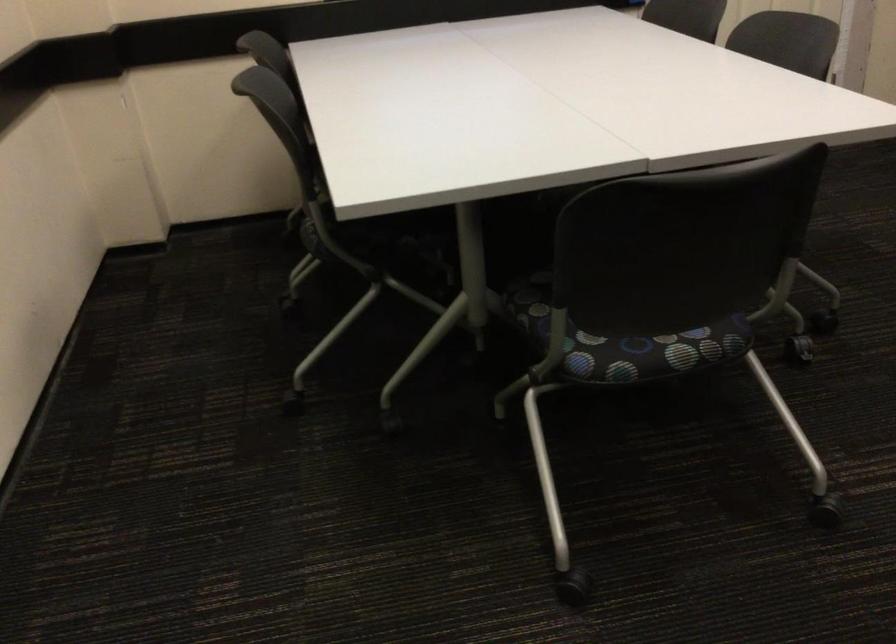
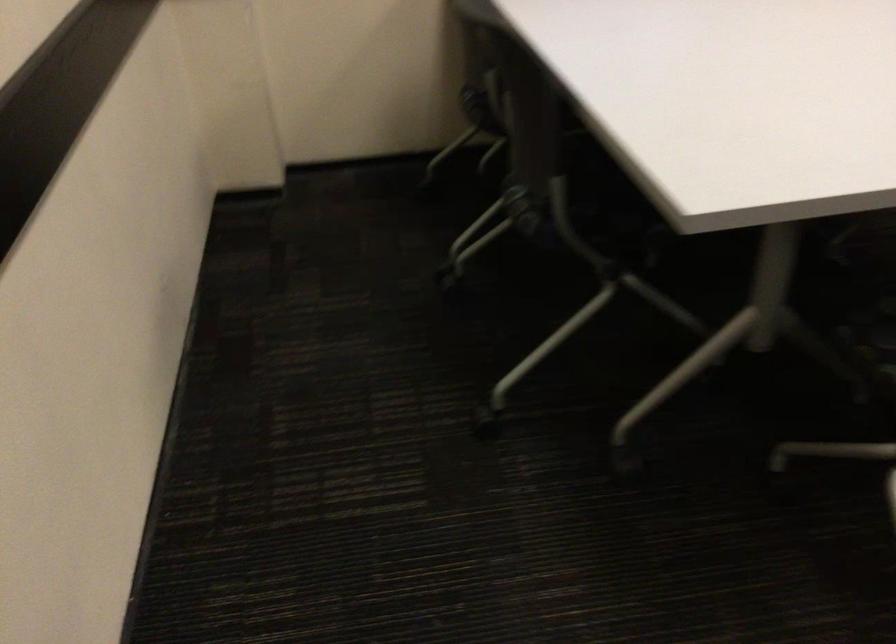
Where in the second image is the point corresponding to (383,240) from the first image?

(619, 227)